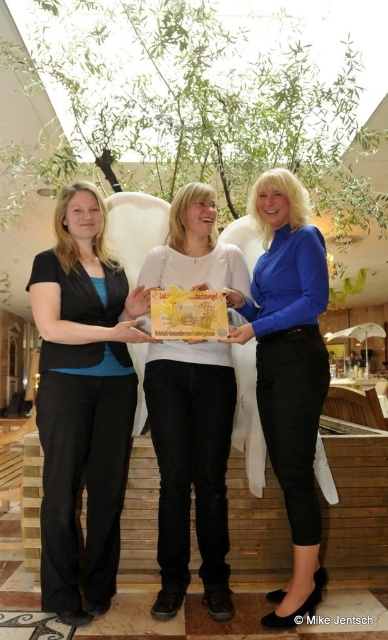
Who is higher up, white matte gift box at center or blue satin blouse at center?

Positioned higher is blue satin blouse at center.

Who is positioned more to the right, white matte gift box at center or blue satin blouse at center?

blue satin blouse at center is more to the right.

Is point (147, 396) positioned after point (323, 397)?

Yes, it is.

Find the location of a particular element. The width and height of the screenshot is (388, 640). white matte gift box at center is located at coordinates (190, 467).

Is matte black pants at left taller than blue satin blouse at center?

Incorrect, matte black pants at left's height is not larger of blue satin blouse at center's.

Is matte black pants at left to the left of blue satin blouse at center from the viewer's perspective?

Correct, you'll find matte black pants at left to the left of blue satin blouse at center.

Who is more distant from viewer, (48, 499) or (282, 602)?

The point (282, 602) is more distant.

At what (x,y) coordinates should I click in order to perform the action: click on matte black pants at left. Please return your answer as a coordinate pair (x, y). Image resolution: width=388 pixels, height=640 pixels. Looking at the image, I should click on (83, 401).

Who is shorter, matte black pants at left or white matte gift box at center?

Standing shorter between the two is white matte gift box at center.

Can you confirm if matte black pants at left is bigger than white matte gift box at center?

Correct, matte black pants at left is larger in size than white matte gift box at center.

Measure the distance between point (91, 284) and camera.

Point (91, 284) is 7.26 feet away from camera.

This screenshot has height=640, width=388. I want to click on matte black pants at left, so click(83, 401).